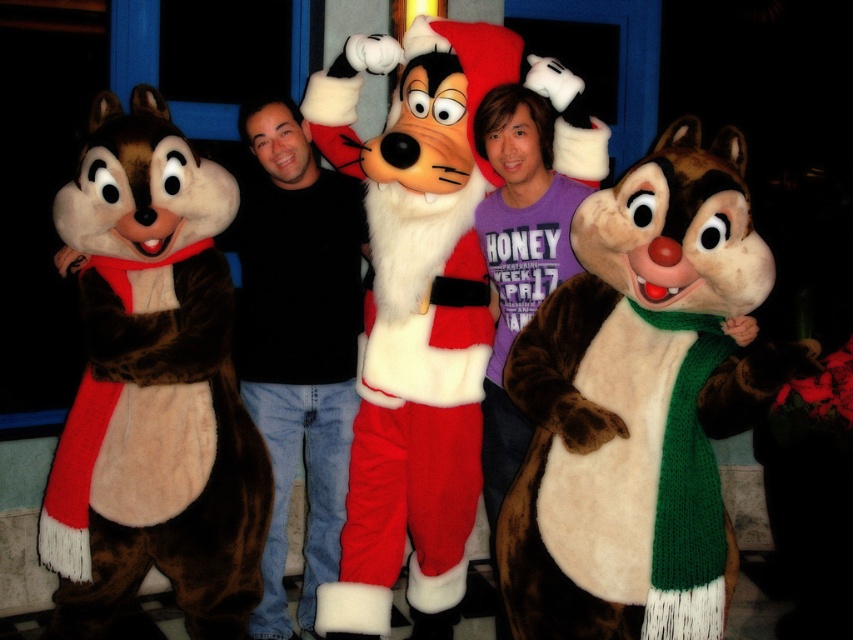
Question: Which point is farther from the camera taking this photo?

Choices:
 (A) (607, 592)
 (B) (345, 369)

Answer: (B)

Question: Which object appears closest to the camera in this image?

Choices:
 (A) brown furry chipmunk at center
 (B) brown furry chipmunk at left
 (C) black cotton shirt at center

Answer: (A)

Question: Which object is the closest to the brown furry chipmunk at center?

Choices:
 (A) black cotton shirt at center
 (B) brown furry chipmunk at left

Answer: (B)

Question: Is brown furry chipmunk at left below black cotton shirt at center?

Choices:
 (A) yes
 (B) no

Answer: (B)

Question: Is brown furry chipmunk at center further to camera compared to black cotton shirt at center?

Choices:
 (A) no
 (B) yes

Answer: (A)

Question: Can you confirm if brown furry chipmunk at center is positioned below black cotton shirt at center?

Choices:
 (A) no
 (B) yes

Answer: (B)